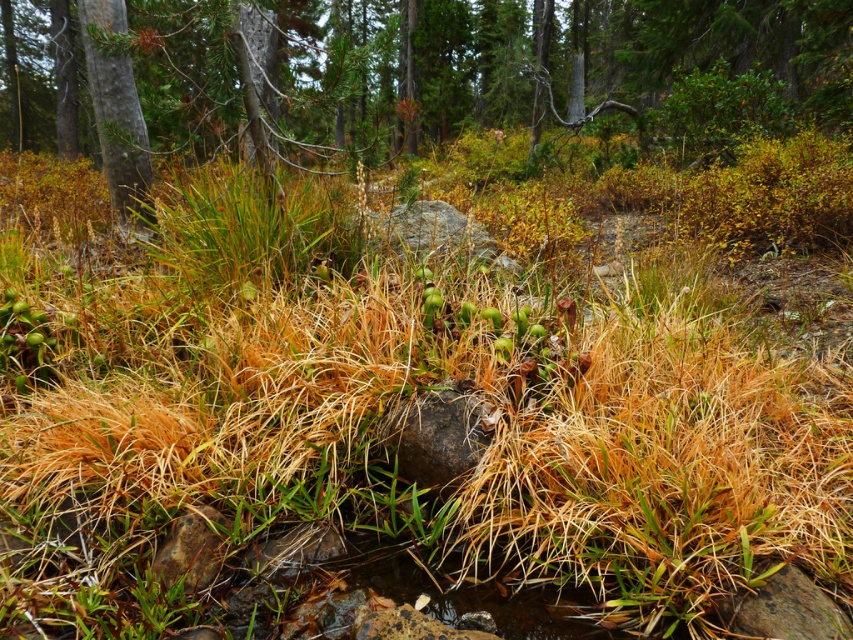
Question: Which object is farther from the camera taking this photo?

Choices:
 (A) green textured tree at upper left
 (B) green matte tree at center

Answer: (A)

Question: Which point is farther from the camera taking this photo?

Choices:
 (A) (521, 29)
 (B) (131, 180)

Answer: (A)

Question: Does green matte tree at center appear over green textured tree at upper left?

Choices:
 (A) no
 (B) yes

Answer: (B)

Question: Which of the following is the farthest from the observer?

Choices:
 (A) green matte tree at center
 (B) green textured tree at upper left

Answer: (B)

Question: Can you confirm if green matte tree at center is positioned to the right of green textured tree at upper left?

Choices:
 (A) yes
 (B) no

Answer: (B)

Question: Is green matte tree at center to the right of green textured tree at upper left from the viewer's perspective?

Choices:
 (A) yes
 (B) no

Answer: (B)